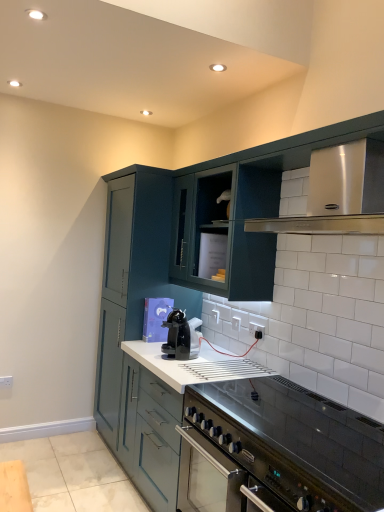
How much space does white plastic electric outlet at lower left, the second electric outlet in the front-to-back sequence, occupy horizontally?

white plastic electric outlet at lower left, the second electric outlet in the front-to-back sequence, is 0.77 inches wide.

Image resolution: width=384 pixels, height=512 pixels. Find the location of `satin silver vent at upper right`. satin silver vent at upper right is located at coordinates (338, 193).

What do you see at coordinates (132, 294) in the screenshot? Image resolution: width=384 pixels, height=512 pixels. I see `teal matte cabinet at center, marked as the first cabinetry in a back-to-front arrangement` at bounding box center [132, 294].

This screenshot has width=384, height=512. What do you see at coordinates (246, 439) in the screenshot? I see `white glossy countertop at center` at bounding box center [246, 439].

The width and height of the screenshot is (384, 512). What do you see at coordinates (247, 468) in the screenshot?
I see `stainless steel oven at lower right` at bounding box center [247, 468].

This screenshot has height=512, width=384. I want to click on stainless steel oven at lower right, so click(x=247, y=468).

The height and width of the screenshot is (512, 384). I want to click on white plastic electric outlet at center, acting as the 2th electric outlet starting from the bottom, so click(x=257, y=325).

At what (x,y) coordinates should I click in order to perform the action: click on white plastic electric outlet at lower left, the second electric outlet in the front-to-back sequence. Please return your answer as a coordinate pair (x, y). The height and width of the screenshot is (512, 384). Looking at the image, I should click on (6, 382).

Between stainless steel oven at lower right and white glossy countertop at center, which one has smaller size?

stainless steel oven at lower right is smaller.

Does point (185, 507) appear closer or farther from the camera than point (286, 395)?

Point (185, 507) is farther from the camera than point (286, 395).

Between stainless steel oven at lower right and white glossy countertop at center, which one appears on the right side from the viewer's perspective?

From the viewer's perspective, stainless steel oven at lower right appears more on the right side.

Based on the photo, considering the relative sizes of stainless steel oven at lower right and white glossy countertop at center in the image provided, is stainless steel oven at lower right shorter than white glossy countertop at center?

Indeed, stainless steel oven at lower right has a lesser height compared to white glossy countertop at center.

Is white glossy countertop at center smaller than white plastic electric outlet at lower left, which is counted as the first electric outlet, starting from the back?

No.

From the white glossy countertop at center, count 2nd electric outlets backward and point to it. Please provide its 2D coordinates.

[(6, 382)]

Does white glossy countertop at center lie in front of white plastic electric outlet at lower left, which is counted as the first electric outlet, starting from the back?

Yes, white glossy countertop at center is closer to the viewer.

Considering the positions of point (256, 480) and point (1, 386), is point (256, 480) closer or farther from the camera than point (1, 386)?

Point (256, 480) appears to be closer to the viewer than point (1, 386).

Is black glossy coffee machine at center shorter than satin silver vent at upper right?

Yes, black glossy coffee machine at center is shorter than satin silver vent at upper right.

Is black glossy coffee machine at center positioned with its back to satin silver vent at upper right?

No, black glossy coffee machine at center's orientation is not away from satin silver vent at upper right.

In terms of size, does black glossy coffee machine at center appear bigger or smaller than satin silver vent at upper right?

black glossy coffee machine at center is smaller than satin silver vent at upper right.

Is satin silver vent at upper right located within black glossy coffee machine at center?

No, satin silver vent at upper right is not inside black glossy coffee machine at center.

Is white plastic electric outlet at center, acting as the 2th electric outlet starting from the bottom, facing away from white plastic electric outlet at lower left, acting as the 1th electric outlet starting from the left?

white plastic electric outlet at center, acting as the 2th electric outlet starting from the bottom, does not have its back to white plastic electric outlet at lower left, acting as the 1th electric outlet starting from the left.

Does white plastic electric outlet at center, the 1th electric outlet when ordered from right to left, have a larger size compared to white plastic electric outlet at lower left, marked as the first electric outlet in a bottom-to-top arrangement?

Yes, white plastic electric outlet at center, the 1th electric outlet when ordered from right to left, is bigger than white plastic electric outlet at lower left, marked as the first electric outlet in a bottom-to-top arrangement.

From the image's perspective, which object appears higher, white plastic electric outlet at center, the second electric outlet viewed from the left, or white plastic electric outlet at lower left, placed as the 2th electric outlet when sorted from top to bottom?

white plastic electric outlet at center, the second electric outlet viewed from the left, appears higher in the image.

From a real-world perspective, is white plastic electric outlet at center, acting as the 2th electric outlet starting from the bottom, positioned under white plastic electric outlet at lower left, which appears as the second electric outlet when viewed from the right, based on gravity?

No.

Considering the sizes of stainless steel oven at lower right and teal matte cabinet at center, which is counted as the first cabinetry, starting from the front, in the image, is stainless steel oven at lower right taller or shorter than teal matte cabinet at center, which is counted as the first cabinetry, starting from the front,?

stainless steel oven at lower right is shorter than teal matte cabinet at center, which is counted as the first cabinetry, starting from the front.

Which is more to the left, stainless steel oven at lower right or teal matte cabinet at center, the second cabinetry in the back-to-front sequence?

Positioned to the left is teal matte cabinet at center, the second cabinetry in the back-to-front sequence.

Does stainless steel oven at lower right have a greater width compared to teal matte cabinet at center, the second cabinetry in the back-to-front sequence?

Yes.

From the image's perspective, which one is positioned lower, stainless steel oven at lower right or teal matte cabinet at center, which is counted as the first cabinetry, starting from the front?

stainless steel oven at lower right appears lower in the image.

Based on the photo, would you say white plastic electric outlet at lower left, which is counted as the first electric outlet, starting from the back, is to the left or to the right of stainless steel oven at lower right in the picture?

In the image, white plastic electric outlet at lower left, which is counted as the first electric outlet, starting from the back, appears on the left side of stainless steel oven at lower right.

From the image's perspective, which is above, white plastic electric outlet at lower left, which appears as the second electric outlet when viewed from the right, or stainless steel oven at lower right?

stainless steel oven at lower right.

Would you say stainless steel oven at lower right is part of white plastic electric outlet at lower left, placed as the 2th electric outlet when sorted from top to bottom,'s contents?

No, white plastic electric outlet at lower left, placed as the 2th electric outlet when sorted from top to bottom, does not contain stainless steel oven at lower right.

Locate an element on the screen. The height and width of the screenshot is (512, 384). kitchen appliance that is in front of the white plastic electric outlet at lower left, acting as the 1th electric outlet starting from the left is located at coordinates (247, 468).

Is stainless steel oven at lower right positioned with its back to black glossy coffee machine at center?

That's not correct — stainless steel oven at lower right is not looking away from black glossy coffee machine at center.

Is stainless steel oven at lower right next to black glossy coffee machine at center and touching it?

No, stainless steel oven at lower right is not with black glossy coffee machine at center.

From the image's perspective, relative to black glossy coffee machine at center, is stainless steel oven at lower right above or below?

Based on their image positions, stainless steel oven at lower right is located beneath black glossy coffee machine at center.

Can you confirm if stainless steel oven at lower right is smaller than black glossy coffee machine at center?

Incorrect, stainless steel oven at lower right is not smaller in size than black glossy coffee machine at center.

Identify the location of kitchen appliance above the white glossy countertop at center (from a real-world perspective). (247, 468).

You are a GUI agent. You are given a task and a screenshot of the screen. Output one action in this format:
    pyautogui.click(x=<x>, y=<y>)
    Task: Click on the countertop located on the right of white plastic electric outlet at lower left, which is counted as the first electric outlet, starting from the back
    This screenshot has height=512, width=384.
    Given the screenshot: What is the action you would take?
    pyautogui.click(x=246, y=439)

Considering their positions, is teal matte cabinet at center, the second cabinetry in the back-to-front sequence, positioned closer to teal matte cabinet at center, marked as the first cabinetry in a back-to-front arrangement, than stainless steel oven at lower right?

teal matte cabinet at center, the second cabinetry in the back-to-front sequence, lies closer to teal matte cabinet at center, marked as the first cabinetry in a back-to-front arrangement, than the other object.

From the picture: Based on their spatial positions, is teal matte cabinet at center, the second cabinetry in the back-to-front sequence, or white glossy countertop at center closer to satin silver vent at upper right?

Based on the image, teal matte cabinet at center, the second cabinetry in the back-to-front sequence, appears to be nearer to satin silver vent at upper right.

Estimate the real-world distances between objects in this image. Which object is further from black glossy coffee machine at center, stainless steel oven at lower right or teal matte cabinet at center, the second cabinetry in the back-to-front sequence?

stainless steel oven at lower right lies further to black glossy coffee machine at center than the other object.

Considering their positions, is teal matte cabinet at center, marked as the first cabinetry in a back-to-front arrangement, positioned further to teal matte cabinet at center, which is counted as the first cabinetry, starting from the front, than white plastic electric outlet at lower left, acting as the 1th electric outlet starting from the left?

Based on the image, white plastic electric outlet at lower left, acting as the 1th electric outlet starting from the left, appears to be further to teal matte cabinet at center, which is counted as the first cabinetry, starting from the front.

When comparing their distances from white plastic electric outlet at center, the 1th electric outlet when ordered from right to left, does teal matte cabinet at center, marked as the first cabinetry in a back-to-front arrangement, or teal matte cabinet at center, the second cabinetry in the back-to-front sequence, seem further?

teal matte cabinet at center, marked as the first cabinetry in a back-to-front arrangement, is further to white plastic electric outlet at center, the 1th electric outlet when ordered from right to left.

Looking at the image, which one is located further to stainless steel oven at lower right, black glossy coffee machine at center or teal matte cabinet at center, marked as the first cabinetry in a back-to-front arrangement?

The object further to stainless steel oven at lower right is black glossy coffee machine at center.

Looking at the image, which one is located closer to stainless steel oven at lower right, white plastic electric outlet at lower left, the second electric outlet in the front-to-back sequence, or black glossy coffee machine at center?

The object closer to stainless steel oven at lower right is black glossy coffee machine at center.

Estimate the real-world distances between objects in this image. Which object is closer to white glossy countertop at center, stainless steel oven at lower right or black glossy coffee machine at center?

Among the two, stainless steel oven at lower right is located nearer to white glossy countertop at center.

This screenshot has width=384, height=512. What are the coordinates of `electric outlet between white plastic electric outlet at lower left, acting as the 1th electric outlet starting from the left, and stainless steel oven at lower right` in the screenshot? It's located at (257, 325).

In order to click on home appliance between white glossy countertop at center and teal matte cabinet at center, marked as the first cabinetry in a back-to-front arrangement, from front to back in this screenshot , I will do pos(180,336).

At what (x,y) coordinates should I click in order to perform the action: click on cabinetry between stainless steel oven at lower right and black glossy coffee machine at center from front to back. Please return your answer as a coordinate pair (x, y). This screenshot has height=512, width=384. Looking at the image, I should click on (225, 232).

Where is `home appliance between white plastic electric outlet at lower left, marked as the first electric outlet in a bottom-to-top arrangement, and satin silver vent at upper right, in the horizontal direction`? The width and height of the screenshot is (384, 512). home appliance between white plastic electric outlet at lower left, marked as the first electric outlet in a bottom-to-top arrangement, and satin silver vent at upper right, in the horizontal direction is located at coordinates coord(180,336).